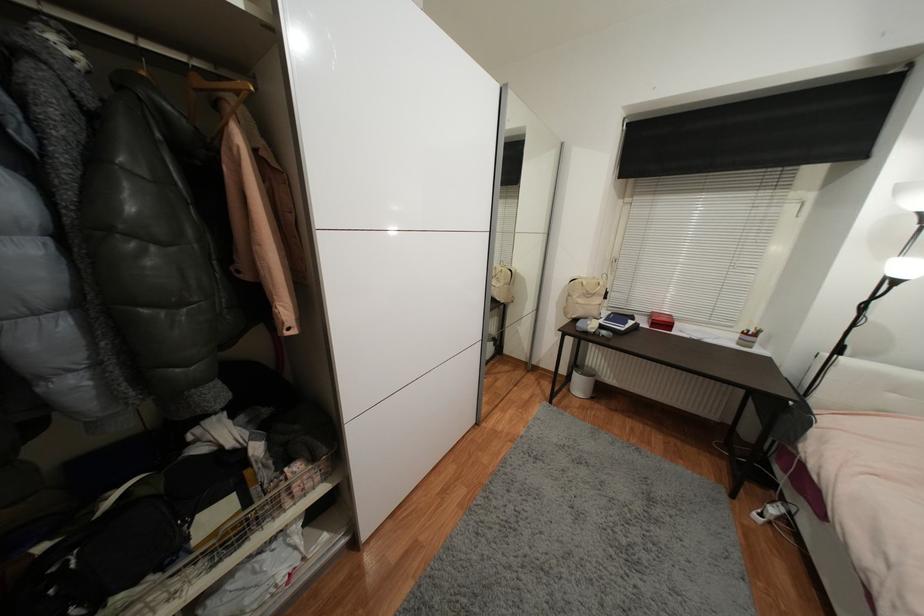
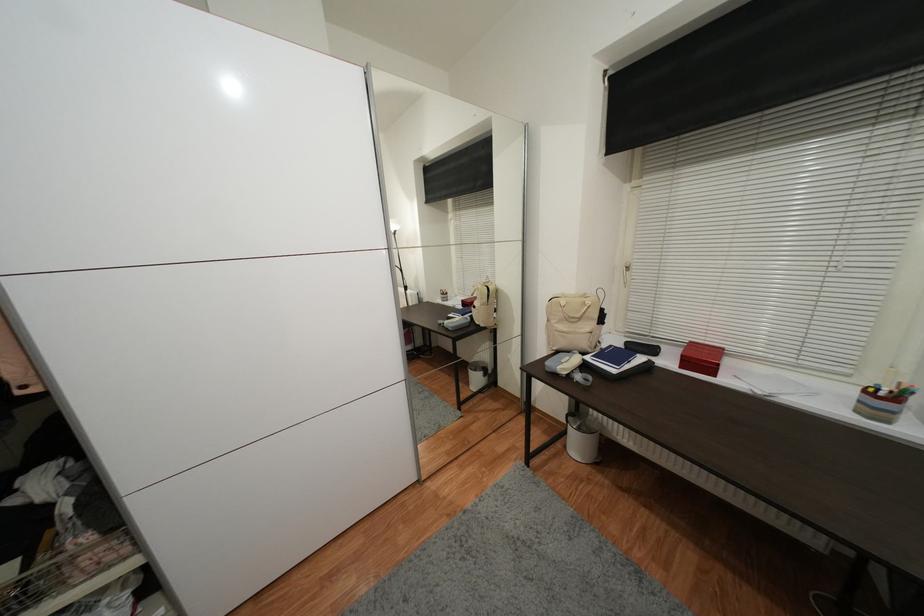
Question: Based on the continuous images, in which direction is the camera rotating? Reply with the corresponding letter.

Choices:
 (A) Left
 (B) Right
 (C) Up
 (D) Down

Answer: (A)